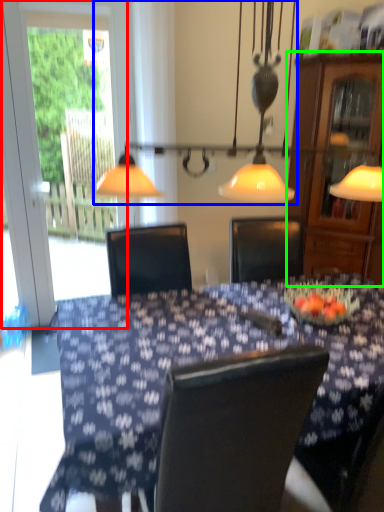
Question: Which object is positioned closest to screen door (highlighted by a red box)? Select from lamp (highlighted by a blue box) and cabinetry (highlighted by a green box).

Choices:
 (A) lamp
 (B) cabinetry

Answer: (A)